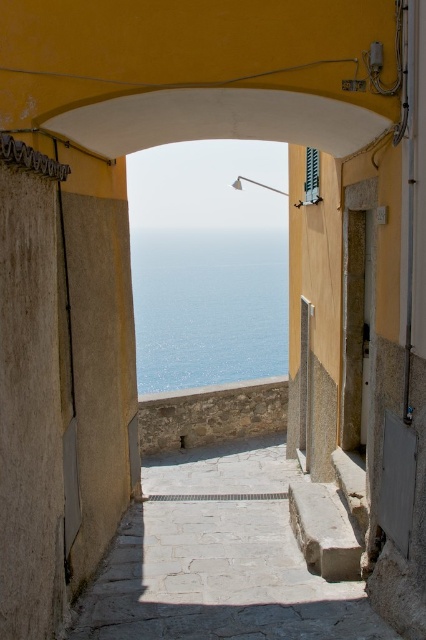
Question: Does stone steps at center have a greater width compared to blue water at center?

Choices:
 (A) yes
 (B) no

Answer: (B)

Question: Among these objects, which one is farthest from the camera?

Choices:
 (A) blue water at center
 (B) stone steps at center

Answer: (A)

Question: Which point is farther to the camera?

Choices:
 (A) stone steps at center
 (B) blue water at center

Answer: (B)

Question: Is the position of stone steps at center more distant than that of blue water at center?

Choices:
 (A) no
 (B) yes

Answer: (A)

Question: Is stone steps at center positioned at the back of blue water at center?

Choices:
 (A) yes
 (B) no

Answer: (B)

Question: Which point is farther to the camera?

Choices:
 (A) (212, 636)
 (B) (169, 296)

Answer: (B)